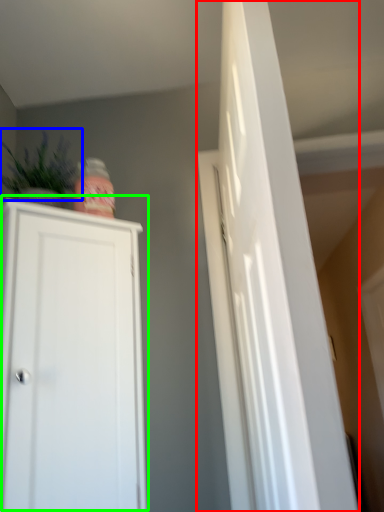
Question: Based on their relative distances, which object is nearer to door (highlighted by a red box)? Choose from plant (highlighted by a blue box) and cupboard (highlighted by a green box).

Choices:
 (A) plant
 (B) cupboard

Answer: (B)